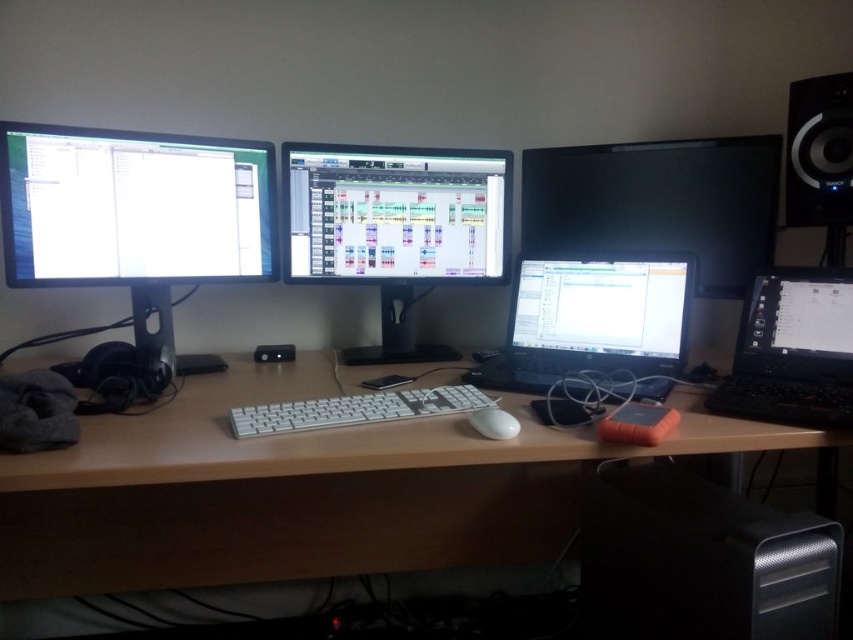
Question: Does white wood computer desk at center come in front of matte black monitor at center?

Choices:
 (A) no
 (B) yes

Answer: (B)

Question: Does white wood computer desk at center appear over matte black monitor at left?

Choices:
 (A) no
 (B) yes

Answer: (A)

Question: Can you confirm if matte black monitor at center is thinner than black plastic speaker at upper right?

Choices:
 (A) no
 (B) yes

Answer: (A)

Question: Among these objects, which one is nearest to the camera?

Choices:
 (A) black glossy laptop at center
 (B) white aluminum keyboard at center
 (C) white glossy mouse at center
 (D) matte black monitor at left

Answer: (C)

Question: Which is farther from the white glossy mouse at center?

Choices:
 (A) matte black monitor at left
 (B) black plastic speaker at upper right
 (C) black glossy laptop at center

Answer: (B)

Question: Which point is farther to the camera?

Choices:
 (A) white glossy mouse at center
 (B) black glossy monitor at upper right
 (C) black glossy laptop at center

Answer: (B)